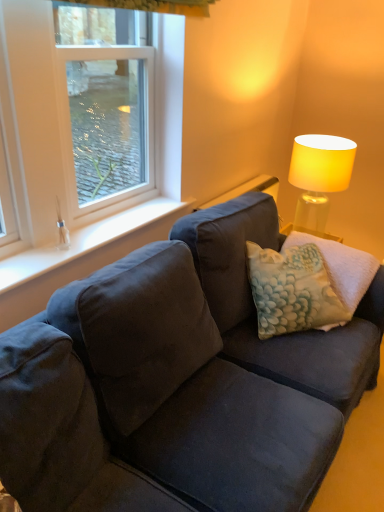
You are a GUI agent. You are given a task and a screenshot of the screen. Output one action in this format:
    pyautogui.click(x=<x>, y=<y>)
    Task: Click on the vacant region above white smooth window sill at lower left (from a real-world perspective)
    
    Given the screenshot: What is the action you would take?
    pyautogui.click(x=97, y=230)